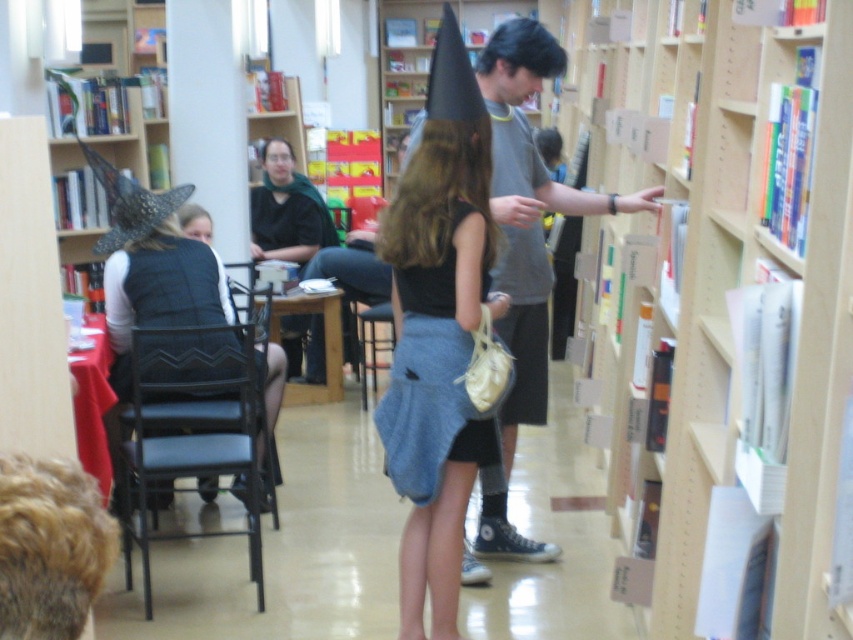
Question: Which is nearer to the wooden bookshelf at left?

Choices:
 (A) black textured vest at left
 (B) matte black shirt at center
 (C) denim skirt at center
 (D) gray cotton t-shirt at center

Answer: (B)

Question: Which point is closer to the camera taking this photo?

Choices:
 (A) 490,573
 (B) 383,320
 (C) 682,140

Answer: (C)

Question: Can you confirm if wooden bookshelf at center is positioned to the left of black fabric chair at center?

Choices:
 (A) no
 (B) yes

Answer: (A)

Question: Can you confirm if wooden bookshelf at center is wider than black fabric chair at center?

Choices:
 (A) no
 (B) yes

Answer: (B)

Question: Can you confirm if gray cotton t-shirt at center is bigger than denim skirt at center?

Choices:
 (A) yes
 (B) no

Answer: (A)

Question: Which point is closer to the camera?

Choices:
 (A) gray cotton t-shirt at center
 (B) black mesh chair at lower left
 (C) wooden bookshelf at left
 (D) denim skirt at center

Answer: (D)